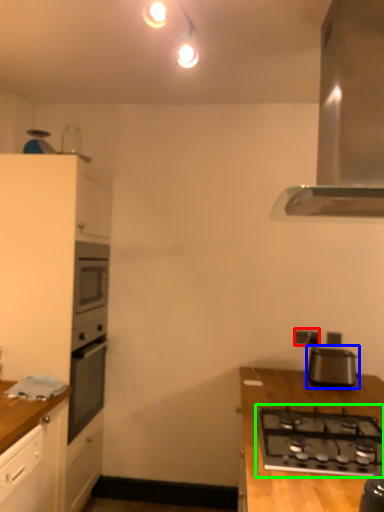
Question: Which object is positioned closest to electric outlet (highlighted by a red box)? Select from appliance (highlighted by a blue box) and gas stove (highlighted by a green box).

Choices:
 (A) appliance
 (B) gas stove

Answer: (A)